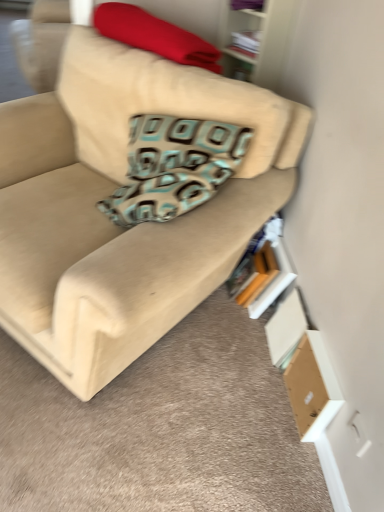
Question: Is hardcover book at lower right, positioned as the 2th book in top-to-bottom order, a part of white paper book at upper center, the 1th book viewed from the top?

Choices:
 (A) no
 (B) yes

Answer: (A)

Question: Is the position of white paper book at upper center, arranged as the 2th book when ordered from the bottom, less distant than that of hardcover book at lower right, the first book from the bottom?

Choices:
 (A) no
 (B) yes

Answer: (A)

Question: Does white paper book at upper center, arranged as the 2th book when ordered from the bottom, have a larger size compared to hardcover book at lower right, the first book from the bottom?

Choices:
 (A) yes
 (B) no

Answer: (B)

Question: Is white paper book at upper center, the 1th book viewed from the top, shorter than hardcover book at lower right, the first book from the bottom?

Choices:
 (A) no
 (B) yes

Answer: (B)

Question: Is white paper book at upper center, arranged as the 2th book when ordered from the bottom, behind hardcover book at lower right, positioned as the 2th book in top-to-bottom order?

Choices:
 (A) no
 (B) yes

Answer: (B)

Question: From a real-world perspective, is wooden bookshelf at upper right above or below brown cardboard box at lower right?

Choices:
 (A) below
 (B) above

Answer: (B)

Question: Is wooden bookshelf at upper right wider or thinner than brown cardboard box at lower right?

Choices:
 (A) thin
 (B) wide

Answer: (B)

Question: Considering their positions, is wooden bookshelf at upper right located in front of or behind brown cardboard box at lower right?

Choices:
 (A) behind
 (B) front

Answer: (A)

Question: Based on their positions, is wooden bookshelf at upper right located to the left or right of brown cardboard box at lower right?

Choices:
 (A) right
 (B) left

Answer: (B)

Question: From the image's perspective, is beige fabric couch at center located above or below brown cardboard box at lower right?

Choices:
 (A) below
 (B) above

Answer: (B)

Question: Considering the positions of beige fabric couch at center and brown cardboard box at lower right in the image, is beige fabric couch at center taller or shorter than brown cardboard box at lower right?

Choices:
 (A) tall
 (B) short

Answer: (A)

Question: Considering the positions of point (150, 228) and point (327, 409), is point (150, 228) closer or farther from the camera than point (327, 409)?

Choices:
 (A) closer
 (B) farther

Answer: (A)

Question: Visually, is beige fabric couch at center positioned to the left or to the right of brown cardboard box at lower right?

Choices:
 (A) left
 (B) right

Answer: (A)

Question: From a real-world perspective, is brown cardboard box at lower right physically located above or below wooden bookshelf at upper right?

Choices:
 (A) below
 (B) above

Answer: (A)

Question: Looking at their shapes, would you say brown cardboard box at lower right is wider or thinner than wooden bookshelf at upper right?

Choices:
 (A) wide
 (B) thin

Answer: (B)